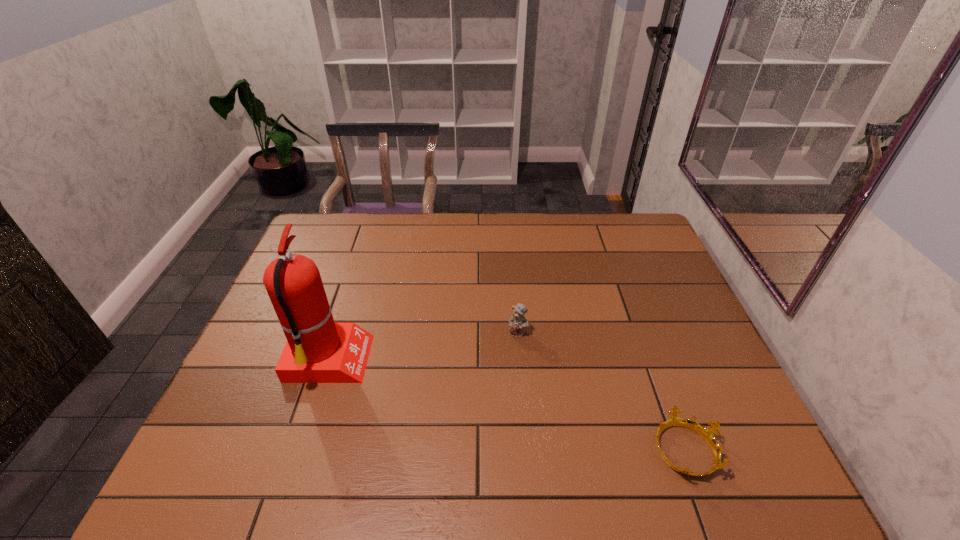
Where is `blank region between the tallest object and the second object from left to right`? This screenshot has height=540, width=960. blank region between the tallest object and the second object from left to right is located at coordinates (423, 347).

I want to click on empty space between the second shortest object and the shortest object, so (601, 390).

Image resolution: width=960 pixels, height=540 pixels. In order to click on vacant space that is in between the crown and the second tallest object in this screenshot , I will do `click(601, 390)`.

Locate an element on the screen. The width and height of the screenshot is (960, 540). vacant space in between the teddy bear and the crown is located at coordinates (601, 390).

At what (x,y) coordinates should I click in order to perform the action: click on vacant area between the teddy bear and the nearest object. Please return your answer as a coordinate pair (x, y). Looking at the image, I should click on (601, 390).

Where is `free area in between the second object from left to right and the shortest object`? This screenshot has width=960, height=540. free area in between the second object from left to right and the shortest object is located at coordinates (601, 390).

Find the location of a particular element. The width and height of the screenshot is (960, 540). unoccupied area between the nearest object and the tallest object is located at coordinates (506, 406).

At what (x,y) coordinates should I click in order to perform the action: click on free space between the second object from left to right and the fire extinguisher. Please return your answer as a coordinate pair (x, y). This screenshot has width=960, height=540. Looking at the image, I should click on (423, 347).

I want to click on free spot between the fire extinguisher and the teddy bear, so click(423, 347).

You are a GUI agent. You are given a task and a screenshot of the screen. Output one action in this format:
    pyautogui.click(x=<x>, y=<y>)
    Task: Click on the vacant area between the shortest object and the second shortest object
    
    Given the screenshot: What is the action you would take?
    pyautogui.click(x=601, y=390)